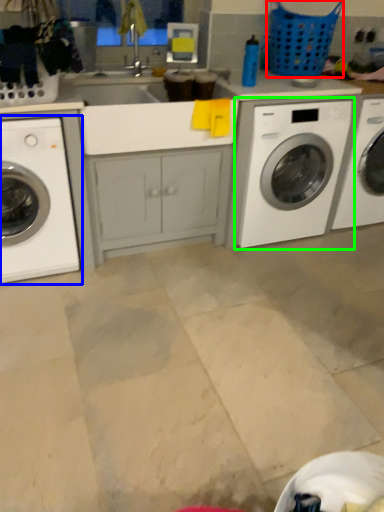
Question: Which object is positioned closest to basket (highlighted by a red box)? Select from washing machine (highlighted by a blue box) and washing machine (highlighted by a green box).

Choices:
 (A) washing machine
 (B) washing machine

Answer: (B)